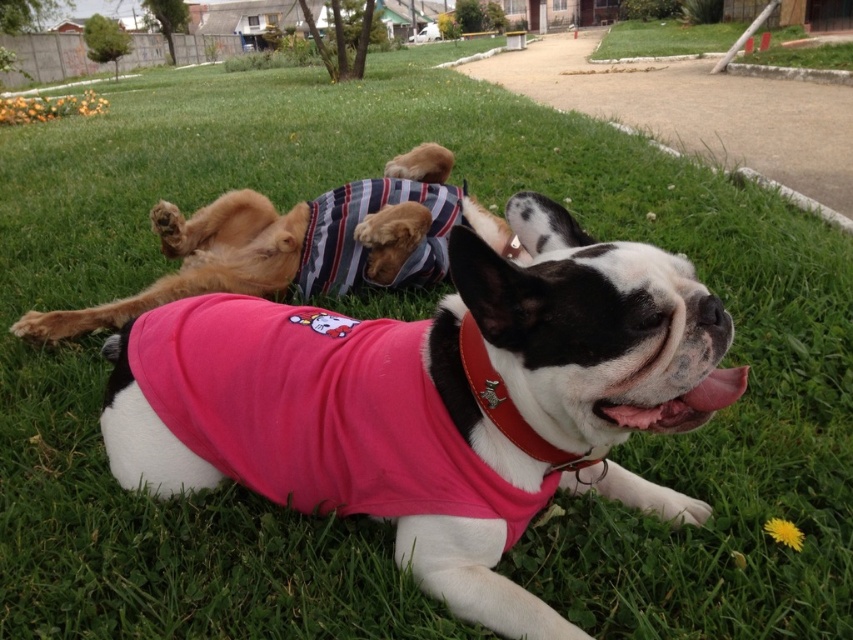
Question: Which of the following is the closest to the observer?

Choices:
 (A) (93, 307)
 (B) (485, 360)

Answer: (B)

Question: Does striped fabric dog at upper center appear over red leather collar at center?

Choices:
 (A) yes
 (B) no

Answer: (A)

Question: Which object appears farthest from the camera in this image?

Choices:
 (A) striped fabric dog at upper center
 (B) red leather collar at center

Answer: (A)

Question: Which point is farther from the camera taking this photo?

Choices:
 (A) (488, 404)
 (B) (396, 256)

Answer: (B)

Question: Observing the image, what is the correct spatial positioning of striped fabric dog at upper center in reference to red leather collar at center?

Choices:
 (A) left
 (B) right

Answer: (A)

Question: Is striped fabric dog at upper center positioned at the back of red leather collar at center?

Choices:
 (A) no
 (B) yes

Answer: (B)